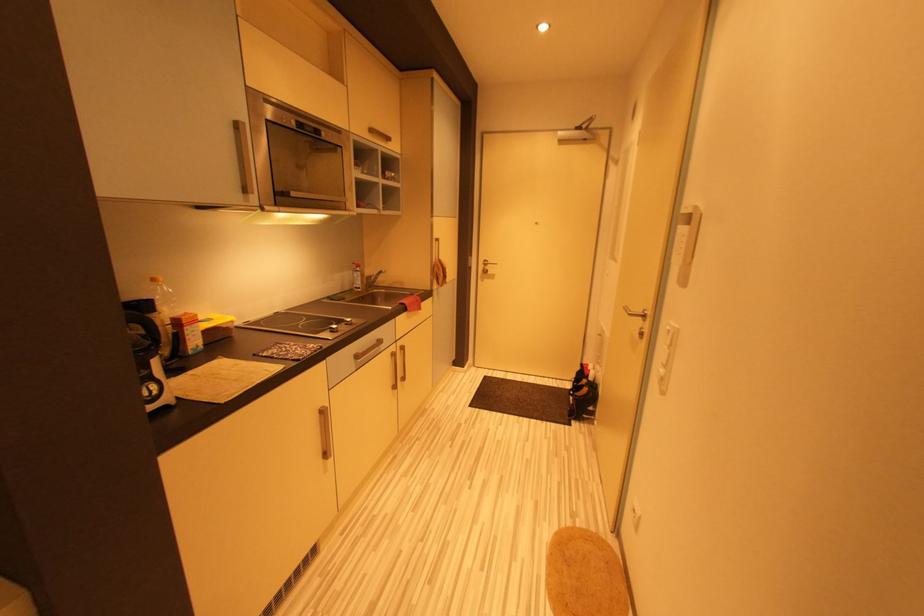
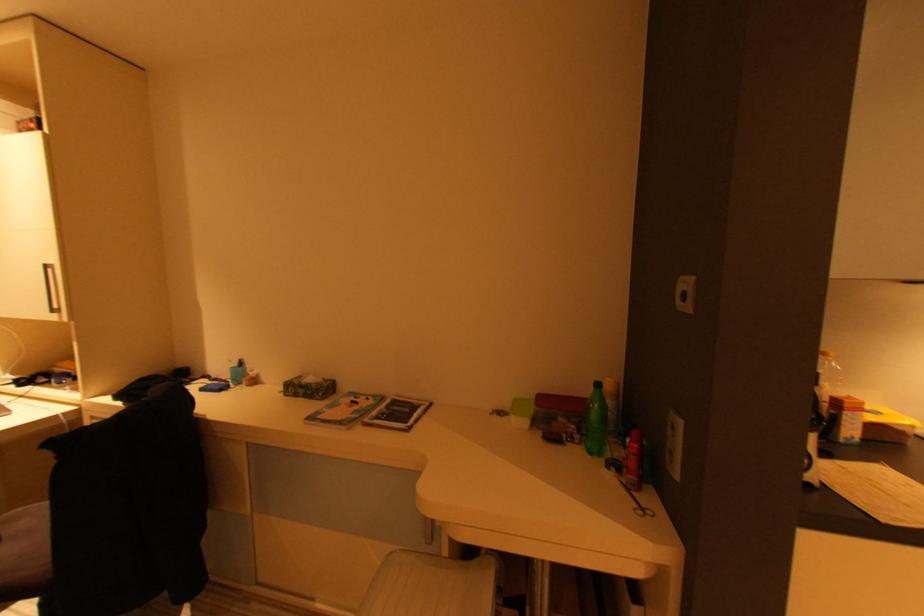
Question: The images are taken continuously from a first-person perspective. In which direction is your viewpoint rotating?

Choices:
 (A) Left
 (B) Right
 (C) Up
 (D) Down

Answer: (A)